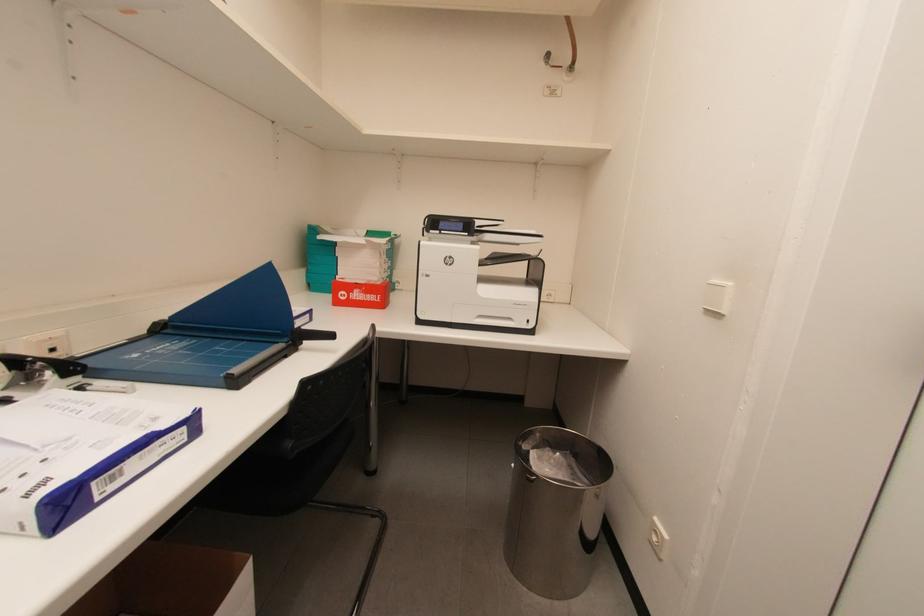
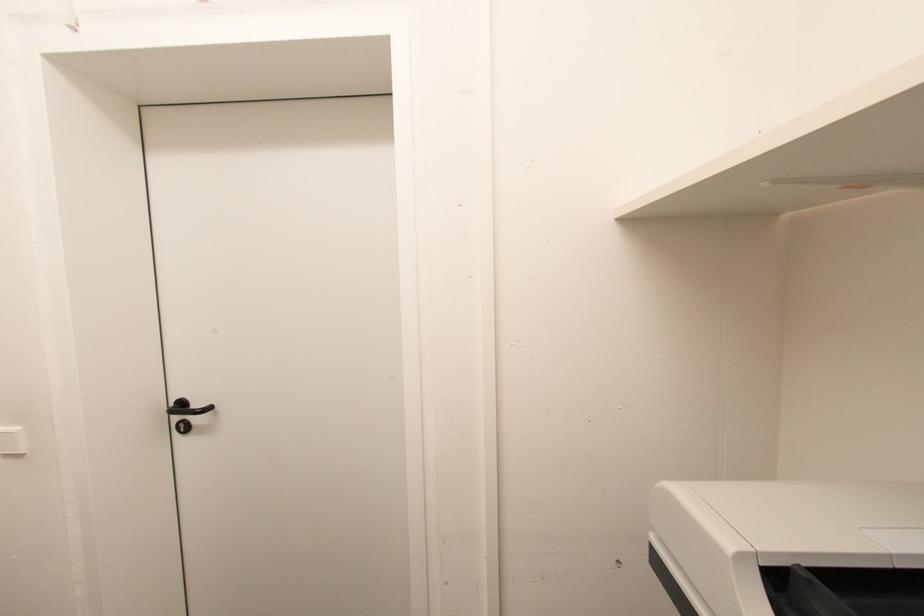
Question: How did the camera likely rotate?

Choices:
 (A) Left
 (B) Right
 (C) Up
 (D) Down

Answer: (B)